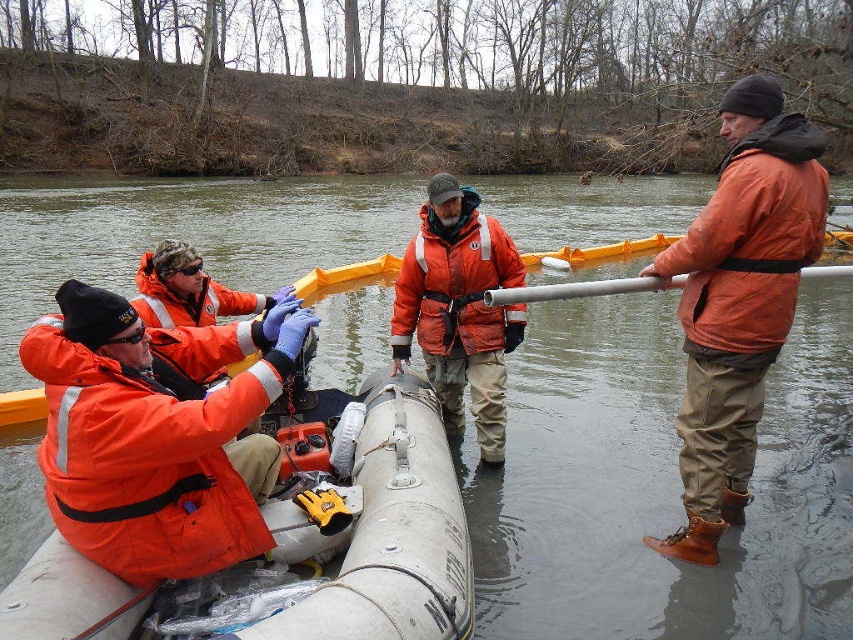
Question: Is orange matte jacket at center closer to camera compared to silver metallic pipe at right?

Choices:
 (A) yes
 (B) no

Answer: (B)

Question: Which of these objects is positioned closest to the orange matte jacket at center?

Choices:
 (A) orange reflective life jacket at center
 (B) silver metallic pipe at right
 (C) orange matte jacket at right

Answer: (A)

Question: Which point is farther to the camera?

Choices:
 (A) (619, 458)
 (B) (410, 314)
 (C) (418, 625)

Answer: (A)

Question: Can you confirm if white rubber boat at center is positioned above orange reflective life jacket at center?

Choices:
 (A) no
 (B) yes

Answer: (A)

Question: Does orange matte jacket at left have a lesser width compared to orange reflective life jacket at center?

Choices:
 (A) yes
 (B) no

Answer: (B)

Question: Which object is closer to the camera taking this photo?

Choices:
 (A) orange matte jacket at right
 (B) silver metallic pipe at right
 (C) orange reflective life jacket at center
 (D) orange matte jacket at left

Answer: (D)